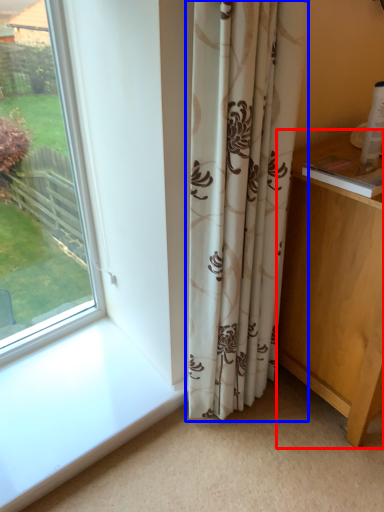
Question: Which point is closer to the camera, vanity (highlighted by a red box) or curtain (highlighted by a blue box)?

Choices:
 (A) vanity
 (B) curtain

Answer: (B)